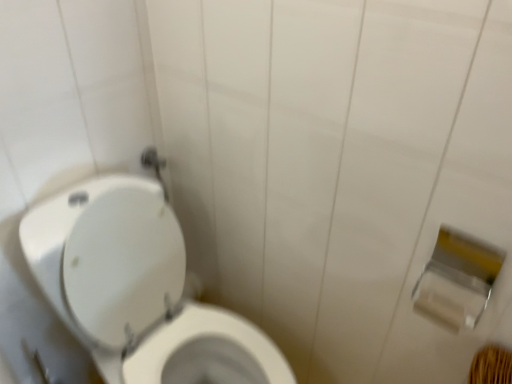
Question: Would you consider white glossy toilet at left to be distant from silver metallic toilet paper at right, arranged as the first toilet paper when viewed from the top?

Choices:
 (A) yes
 (B) no

Answer: (B)

Question: Does white glossy toilet at left appear on the left side of silver metallic toilet paper at right, the second toilet paper ordered from the bottom?

Choices:
 (A) no
 (B) yes

Answer: (B)

Question: From a real-world perspective, does white glossy toilet at left sit lower than silver metallic toilet paper at right, the second toilet paper ordered from the bottom?

Choices:
 (A) yes
 (B) no

Answer: (A)

Question: Considering the relative positions of white glossy toilet at left and silver metallic toilet paper at right, the second toilet paper ordered from the bottom, in the image provided, is white glossy toilet at left to the right of silver metallic toilet paper at right, the second toilet paper ordered from the bottom, from the viewer's perspective?

Choices:
 (A) no
 (B) yes

Answer: (A)

Question: Does white glossy toilet at left have a greater height compared to silver metallic toilet paper at right, arranged as the first toilet paper when viewed from the top?

Choices:
 (A) yes
 (B) no

Answer: (A)

Question: Considering their positions, is silver metallic toilet paper at right, the second toilet paper ordered from the bottom, located in front of or behind white matte toilet paper at right, positioned as the 2th toilet paper in top-to-bottom order?

Choices:
 (A) front
 (B) behind

Answer: (A)

Question: From the image's perspective, relative to white matte toilet paper at right, positioned as the 2th toilet paper in top-to-bottom order, is silver metallic toilet paper at right, arranged as the first toilet paper when viewed from the top, above or below?

Choices:
 (A) below
 (B) above

Answer: (B)

Question: Looking at their shapes, would you say silver metallic toilet paper at right, the second toilet paper ordered from the bottom, is wider or thinner than white matte toilet paper at right, positioned as the 1th toilet paper in bottom-to-top order?

Choices:
 (A) wide
 (B) thin

Answer: (A)

Question: Is silver metallic toilet paper at right, the second toilet paper ordered from the bottom, taller or shorter than white matte toilet paper at right, positioned as the 1th toilet paper in bottom-to-top order?

Choices:
 (A) tall
 (B) short

Answer: (A)

Question: Based on their sizes in the image, would you say white glossy toilet at left is bigger or smaller than silver metallic toilet paper at right, the second toilet paper ordered from the bottom?

Choices:
 (A) big
 (B) small

Answer: (A)

Question: Is white glossy toilet at left taller or shorter than silver metallic toilet paper at right, arranged as the first toilet paper when viewed from the top?

Choices:
 (A) short
 (B) tall

Answer: (B)

Question: From a real-world perspective, is white glossy toilet at left above or below silver metallic toilet paper at right, arranged as the first toilet paper when viewed from the top?

Choices:
 (A) below
 (B) above

Answer: (A)

Question: Choose the correct answer: Is white glossy toilet at left inside silver metallic toilet paper at right, arranged as the first toilet paper when viewed from the top, or outside it?

Choices:
 (A) inside
 (B) outside

Answer: (B)

Question: Does point (429, 312) appear closer or farther from the camera than point (71, 206)?

Choices:
 (A) farther
 (B) closer

Answer: (B)

Question: From the image's perspective, is white matte toilet paper at right, positioned as the 1th toilet paper in bottom-to-top order, located above or below white glossy toilet at left?

Choices:
 (A) above
 (B) below

Answer: (A)